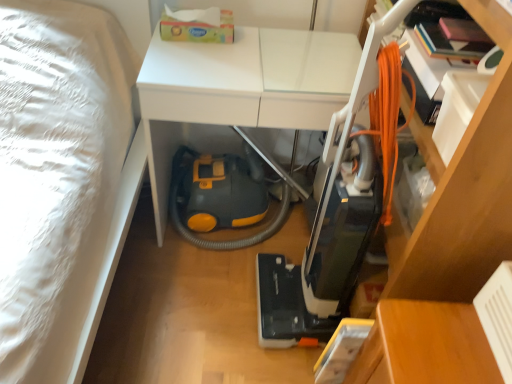
Question: Is wooden table at lower right, the second table viewed from the top, in front of or behind white glossy table at center, the 1th table positioned from the left, in the image?

Choices:
 (A) behind
 (B) front

Answer: (B)

Question: Looking at their shapes, would you say wooden table at lower right, placed as the 1th table when sorted from bottom to top, is wider or thinner than white glossy table at center, which is the 2th table from bottom to top?

Choices:
 (A) wide
 (B) thin

Answer: (B)

Question: Considering the real-world distances, which object is farthest from the white glossy table at center, which is the 2th table from bottom to top?

Choices:
 (A) orange corded vacuum cleaner at center
 (B) wooden table at lower right, marked as the first table in a right-to-left arrangement

Answer: (B)

Question: Estimate the real-world distances between objects in this image. Which object is farther from the wooden table at lower right, placed as the 1th table when sorted from bottom to top?

Choices:
 (A) orange corded vacuum cleaner at center
 (B) white glossy table at center, placed as the 1th table when sorted from top to bottom

Answer: (B)